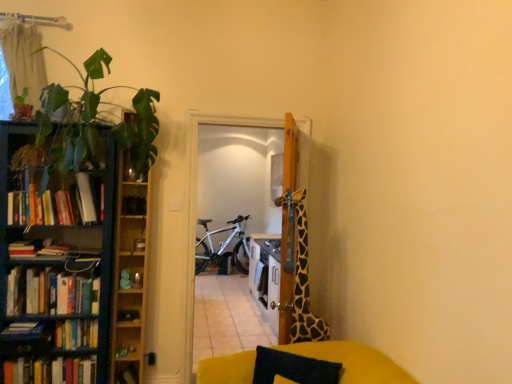
What do you see at coordinates (23, 330) in the screenshot?
I see `hardcover book at left, which is counted as the fourth book, starting from the bottom` at bounding box center [23, 330].

The width and height of the screenshot is (512, 384). I want to click on hardcover books at left, arranged as the 1th book when viewed from the top, so click(x=58, y=204).

Find the location of `green matte bookcase at left`. green matte bookcase at left is located at coordinates (56, 266).

Find the location of `white sheer curtain at upper left`. white sheer curtain at upper left is located at coordinates (23, 60).

This screenshot has height=384, width=512. What are the coordinates of `hardcover book at left, placed as the 3th book when sorted from top to bottom` in the screenshot? It's located at (23, 330).

Consider the image. Which is more to the right, white sheer curtain at upper left or hardcover book at left, which is counted as the fourth book, starting from the bottom?

Positioned to the right is hardcover book at left, which is counted as the fourth book, starting from the bottom.

Can you see white sheer curtain at upper left touching hardcover book at left, placed as the 3th book when sorted from top to bottom?

No, white sheer curtain at upper left is not in contact with hardcover book at left, placed as the 3th book when sorted from top to bottom.

Does point (6, 29) appear closer or farther from the camera than point (16, 331)?

Point (6, 29) appears to be farther away from the viewer than point (16, 331).

Is white sheer curtain at upper left oriented away from hardcover book at left, placed as the 3th book when sorted from top to bottom?

No, white sheer curtain at upper left's orientation is not away from hardcover book at left, placed as the 3th book when sorted from top to bottom.

Considering the sizes of objects hardcover book at left, which is counted as the 5th book, starting from the top, and hardcover book at left, which ranks as the first book in bottom-to-top order, in the image provided, who is thinner, hardcover book at left, which is counted as the 5th book, starting from the top, or hardcover book at left, which ranks as the first book in bottom-to-top order,?

Thinner between the two is hardcover book at left, which ranks as the first book in bottom-to-top order.

Is hardcover book at left, the second book when ordered from bottom to top, far from hardcover book at left, positioned as the sixth book in top-to-bottom order?

No, hardcover book at left, the second book when ordered from bottom to top, is in close proximity to hardcover book at left, positioned as the sixth book in top-to-bottom order.

From the image's perspective, is hardcover book at left, the second book when ordered from bottom to top, above or below hardcover book at left, which ranks as the first book in bottom-to-top order?

hardcover book at left, the second book when ordered from bottom to top, is situated higher than hardcover book at left, which ranks as the first book in bottom-to-top order, in the image.

Based on the photo, could you measure the distance between hardcover book at left, the second book when ordered from bottom to top, and wooden cabinet at left?

hardcover book at left, the second book when ordered from bottom to top, and wooden cabinet at left are 20.52 inches apart from each other.

From the image's perspective, count 4th books downward from the wooden cabinet at left and point to it. Please provide its 2D coordinates.

[(51, 371)]

Is hardcover book at left, which is counted as the 5th book, starting from the top, beside wooden cabinet at left?

No, hardcover book at left, which is counted as the 5th book, starting from the top, is not making contact with wooden cabinet at left.

Does hardcover book at left, which is counted as the 5th book, starting from the top, have a larger size compared to wooden cabinet at left?

No.

Is point (87, 236) in front of point (70, 326)?

No.

Does green matte bookcase at left have a greater height compared to hardcover books at left, which is counted as the third book, starting from the bottom?

Yes, green matte bookcase at left is taller than hardcover books at left, which is counted as the third book, starting from the bottom.

Between green matte bookcase at left and hardcover books at left, the 4th book positioned from the top, which one is positioned behind?

hardcover books at left, the 4th book positioned from the top, is further from the camera.

From a real-world perspective, is green matte bookcase at left positioned above or below hardcover books at left, the 4th book positioned from the top?

From a real-world perspective, green matte bookcase at left is physically above hardcover books at left, the 4th book positioned from the top.

In terms of size, does white matte bicycle at center appear bigger or smaller than hardcover books at left, which appears as the sixth book when ordered from the bottom?

white matte bicycle at center is bigger than hardcover books at left, which appears as the sixth book when ordered from the bottom.

Looking at this image, measure the distance between white matte bicycle at center and hardcover books at left, which appears as the sixth book when ordered from the bottom.

white matte bicycle at center is 16.28 feet from hardcover books at left, which appears as the sixth book when ordered from the bottom.

From the image's perspective, is white matte bicycle at center positioned above or below hardcover books at left, arranged as the 1th book when viewed from the top?

From the image's perspective, white matte bicycle at center appears below hardcover books at left, arranged as the 1th book when viewed from the top.

Considering the sizes of objects white matte bicycle at center and hardcover books at left, arranged as the 1th book when viewed from the top, in the image provided, who is thinner, white matte bicycle at center or hardcover books at left, arranged as the 1th book when viewed from the top,?

hardcover books at left, arranged as the 1th book when viewed from the top, is thinner.

Looking at the image, does hardcover book at left, placed as the 3th book when sorted from top to bottom, seem bigger or smaller compared to hardcover books at left, the 4th book positioned from the top?

Considering their sizes, hardcover book at left, placed as the 3th book when sorted from top to bottom, takes up less space than hardcover books at left, the 4th book positioned from the top.

Is hardcover book at left, which is counted as the fourth book, starting from the bottom, turned away from hardcover books at left, the 4th book positioned from the top?

That's not correct — hardcover book at left, which is counted as the fourth book, starting from the bottom, is not looking away from hardcover books at left, the 4th book positioned from the top.

Is hardcover book at left, which is counted as the fourth book, starting from the bottom, positioned beyond the bounds of hardcover books at left, which is counted as the third book, starting from the bottom?

Yes, hardcover book at left, which is counted as the fourth book, starting from the bottom, is outside of hardcover books at left, which is counted as the third book, starting from the bottom.

How many degrees apart are the facing directions of hardcover book at left, placed as the 3th book when sorted from top to bottom, and hardcover books at left, the 4th book positioned from the top?

hardcover book at left, placed as the 3th book when sorted from top to bottom, and hardcover books at left, the 4th book positioned from the top, are facing 0.732 degrees away from each other.

Does hardcover books at left, placed as the 2th book when sorted from top to bottom, have a smaller size compared to hardcover book at left, which is counted as the fourth book, starting from the bottom?

Incorrect, hardcover books at left, placed as the 2th book when sorted from top to bottom, is not smaller in size than hardcover book at left, which is counted as the fourth book, starting from the bottom.

Which object is closer to the camera taking this photo, hardcover books at left, placed as the 2th book when sorted from top to bottom, or hardcover book at left, which is counted as the fourth book, starting from the bottom?

hardcover book at left, which is counted as the fourth book, starting from the bottom, is more forward.

From a real-world perspective, is hardcover books at left, placed as the 2th book when sorted from top to bottom, positioned over hardcover book at left, which is counted as the fourth book, starting from the bottom, based on gravity?

Correct, in the physical world, hardcover books at left, placed as the 2th book when sorted from top to bottom, is higher than hardcover book at left, which is counted as the fourth book, starting from the bottom.

Is hardcover books at left, placed as the 2th book when sorted from top to bottom, positioned far away from hardcover book at left, which is counted as the fourth book, starting from the bottom?

That's not correct — hardcover books at left, placed as the 2th book when sorted from top to bottom, is a little close to hardcover book at left, which is counted as the fourth book, starting from the bottom.

At what (x,y) coordinates should I click in order to perform the action: click on the 3rd book located beneath the white sheer curtain at upper left (from a real-world perspective). Please return your answer as a coordinate pair (x, y). This screenshot has width=512, height=384. Looking at the image, I should click on (23, 330).

The width and height of the screenshot is (512, 384). Find the location of `book that is the 4th one when counting leftward from the hardcover book at left, positioned as the sixth book in top-to-bottom order`. book that is the 4th one when counting leftward from the hardcover book at left, positioned as the sixth book in top-to-bottom order is located at coordinates (51, 371).

Which object lies nearer to the anchor point white matte bicycle at center, green leafy plant at left or wooden cabinet at left?

wooden cabinet at left is closer to white matte bicycle at center.

From the picture: Which object lies further to the anchor point hardcover book at left, positioned as the sixth book in top-to-bottom order, hardcover books at left, marked as the 5th book in a bottom-to-top arrangement, or green leafy plant at left?

green leafy plant at left is further to hardcover book at left, positioned as the sixth book in top-to-bottom order.

When comparing their distances from hardcover book at left, which ranks as the first book in bottom-to-top order, does green leafy plant at left or green matte bookcase at left seem closer?

green matte bookcase at left.

Estimate the real-world distances between objects in this image. Which object is closer to hardcover books at left, marked as the 5th book in a bottom-to-top arrangement, hardcover books at left, the 4th book positioned from the top, or hardcover book at left, positioned as the sixth book in top-to-bottom order?

hardcover books at left, the 4th book positioned from the top, is closer to hardcover books at left, marked as the 5th book in a bottom-to-top arrangement.

Which object lies nearer to the anchor point hardcover books at left, placed as the 2th book when sorted from top to bottom, hardcover books at left, which appears as the sixth book when ordered from the bottom, or white matte bicycle at center?

hardcover books at left, which appears as the sixth book when ordered from the bottom, is closer to hardcover books at left, placed as the 2th book when sorted from top to bottom.

From the image, which object appears to be nearer to wooden cabinet at left, green matte bookcase at left or hardcover book at left, placed as the 3th book when sorted from top to bottom?

green matte bookcase at left.

Considering their positions, is hardcover books at left, the 4th book positioned from the top, positioned further to white sheer curtain at upper left than hardcover book at left, placed as the 3th book when sorted from top to bottom?

Based on the image, hardcover books at left, the 4th book positioned from the top, appears to be further to white sheer curtain at upper left.

When comparing their distances from hardcover books at left, which is counted as the third book, starting from the bottom, does white sheer curtain at upper left or green leafy plant at left seem further?

Among the two, white sheer curtain at upper left is located further to hardcover books at left, which is counted as the third book, starting from the bottom.

You are a GUI agent. You are given a task and a screenshot of the screen. Output one action in this format:
    pyautogui.click(x=<x>, y=<y>)
    Task: Click on the curtain between green matte bookcase at left and white matte bicycle at center from front to back
    
    Given the screenshot: What is the action you would take?
    pyautogui.click(x=23, y=60)

Image resolution: width=512 pixels, height=384 pixels. In order to click on bookcase between hardcover book at left, the second book when ordered from bottom to top, and black fabric pillow at lower center from left to right in this screenshot , I will do `click(56, 266)`.

At what (x,y) coordinates should I click in order to perform the action: click on book located between hardcover books at left, which is counted as the third book, starting from the bottom, and black fabric pillow at lower center in the left-right direction. Please return your answer as a coordinate pair (x, y). Looking at the image, I should click on (126, 373).

Find the location of `curtain located between hardcover books at left, which is counted as the third book, starting from the bottom, and white matte bicycle at center in the depth direction`. curtain located between hardcover books at left, which is counted as the third book, starting from the bottom, and white matte bicycle at center in the depth direction is located at coordinates (23, 60).